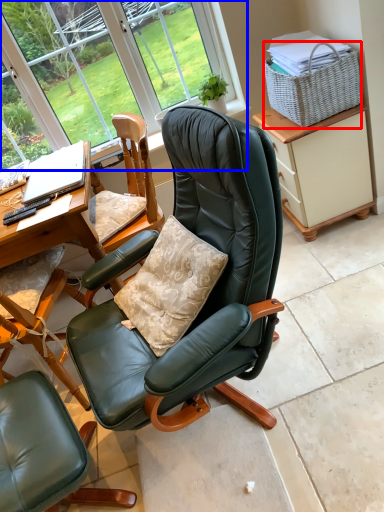
Question: Which of the following is the closest to the observer, picnic basket (highlighted by a red box) or bay window (highlighted by a blue box)?

Choices:
 (A) picnic basket
 (B) bay window

Answer: (A)